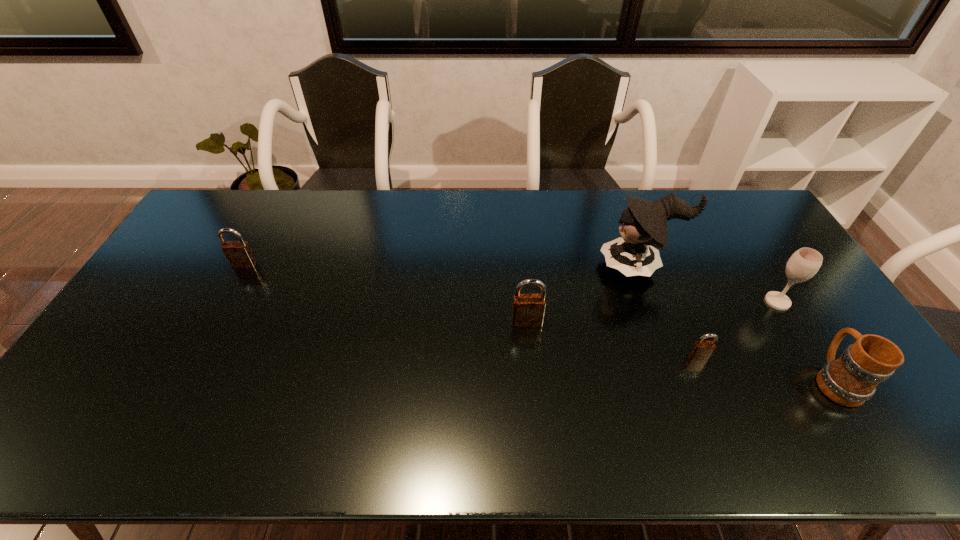
Identify the location of padlock that is the closest to the mug. (701, 350).

At what (x,y) coordinates should I click in order to perform the action: click on vacant area that satisfies the following two spatial constraints: 1. at the face of the wineglass; 2. on the left side of the tallest object. Please return your answer as a coordinate pair (x, y). The height and width of the screenshot is (540, 960). Looking at the image, I should click on (653, 301).

At what (x,y) coordinates should I click in order to perform the action: click on free spot that satisfies the following two spatial constraints: 1. on the front-facing side of the leftmost padlock; 2. on the left side of the third farthest object. Please return your answer as a coordinate pair (x, y). Looking at the image, I should click on (225, 301).

Locate an element on the screen. The height and width of the screenshot is (540, 960). blank space that satisfies the following two spatial constraints: 1. at the face of the tallest object; 2. on the front-facing side of the fourth farthest object is located at coordinates (660, 322).

You are a GUI agent. You are given a task and a screenshot of the screen. Output one action in this format:
    pyautogui.click(x=<x>, y=<y>)
    Task: Click on the vacant space that satisfies the following two spatial constraints: 1. on the front-facing side of the farthest padlock; 2. on the left side of the fourth nearest object
    
    Given the screenshot: What is the action you would take?
    pyautogui.click(x=225, y=301)

Identify the location of vacant region that satisfies the following two spatial constraints: 1. on the back side of the fourth nearest object; 2. at the face of the doll. The image size is (960, 540). (756, 266).

The height and width of the screenshot is (540, 960). Identify the location of vacant area in the image that satisfies the following two spatial constraints: 1. at the face of the tallest object; 2. on the side of the mug with the handle. (681, 380).

Locate an element on the screen. vacant space that satisfies the following two spatial constraints: 1. on the front-facing side of the third farthest object; 2. on the right side of the farthest padlock is located at coordinates (225, 301).

Find the location of a particular element. The height and width of the screenshot is (540, 960). free location that satisfies the following two spatial constraints: 1. at the face of the tallest object; 2. on the front-facing side of the second nearest padlock is located at coordinates (660, 322).

Image resolution: width=960 pixels, height=540 pixels. In order to click on vacant space that satisfies the following two spatial constraints: 1. on the side of the mug with the handle; 2. at the face of the doll in this screenshot , I will do `click(762, 266)`.